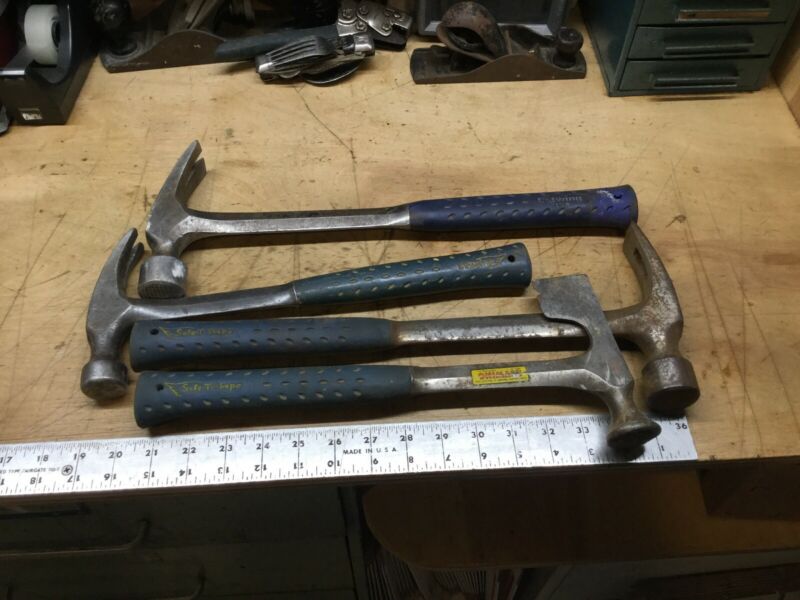
This screenshot has height=600, width=800. What are the coordinates of `surface of toolbench` in the screenshot? It's located at (448, 141).